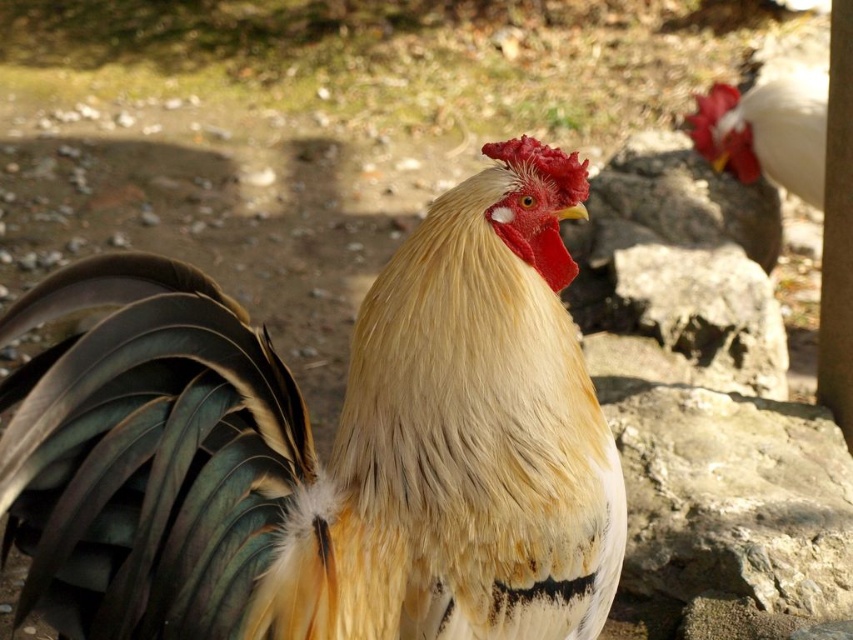
Question: Does golden feathered rooster at center appear under white glossy rooster at upper right?

Choices:
 (A) yes
 (B) no

Answer: (A)

Question: Is golden feathered rooster at center below white glossy rooster at upper right?

Choices:
 (A) no
 (B) yes

Answer: (B)

Question: Which object appears farthest from the camera in this image?

Choices:
 (A) white glossy rooster at upper right
 (B) golden feathered rooster at center

Answer: (A)

Question: Among these objects, which one is nearest to the camera?

Choices:
 (A) white glossy rooster at upper right
 (B) golden feathered rooster at center

Answer: (B)

Question: Which point is closer to the camera?

Choices:
 (A) (375, 384)
 (B) (781, 141)

Answer: (A)

Question: Is golden feathered rooster at center above white glossy rooster at upper right?

Choices:
 (A) yes
 (B) no

Answer: (B)